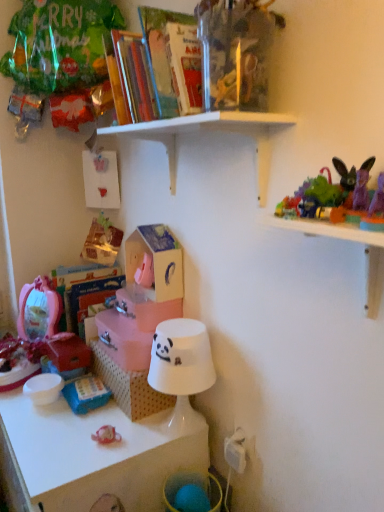
The width and height of the screenshot is (384, 512). What do you see at coordinates (156, 261) in the screenshot? I see `wooden house at center, the first storage box positioned from the top` at bounding box center [156, 261].

In order to face white wooden shelf at upper center, arranged as the first shelf when viewed from the top, should I rotate leftwards or rightwards?

Turn left by 1.722 degrees to look at white wooden shelf at upper center, arranged as the first shelf when viewed from the top.

Find the location of a particular element. The image size is (384, 512). white wooden shelf at upper center, which is the 3th shelf from bottom to top is located at coordinates (206, 131).

What do you see at coordinates (150, 62) in the screenshot? Image resolution: width=384 pixels, height=512 pixels. I see `hardcover book at upper center` at bounding box center [150, 62].

Describe the element at coordinates (133, 326) in the screenshot. I see `pink matte storage box at center, placed as the 2th storage box when sorted from top to bottom` at that location.

At what (x,y) coordinates should I click in order to perform the action: click on wooden house at center, the first storage box positioned from the top. Please return your answer as a coordinate pair (x, y). This screenshot has height=512, width=384. Looking at the image, I should click on (156, 261).

Is blue plastic toy at lower left, the 2th toy from the right, oriented away from white glossy lampshade at lower center, which ranks as the first shelf in bottom-to-top order?

blue plastic toy at lower left, the 2th toy from the right, is not turned away from white glossy lampshade at lower center, which ranks as the first shelf in bottom-to-top order.

Considering the positions of points (67, 386) and (0, 407), is point (67, 386) closer to camera compared to point (0, 407)?

Yes, it is.

Is white glossy lampshade at lower center, which ranks as the first shelf in bottom-to-top order, a part of blue plastic toy at lower left, the second toy viewed from the left?

That's incorrect, white glossy lampshade at lower center, which ranks as the first shelf in bottom-to-top order, is not inside blue plastic toy at lower left, the second toy viewed from the left.

Which is more to the left, blue plastic toy at lower left, which appears as the 1th toy when ordered from the bottom, or white glossy lampshade at lower center, which ranks as the first shelf in bottom-to-top order?

white glossy lampshade at lower center, which ranks as the first shelf in bottom-to-top order.

Based on the photo, does wooden house at center, the first storage box positioned from the top, have a greater width compared to white cardboard box at center?

In fact, wooden house at center, the first storage box positioned from the top, might be narrower than white cardboard box at center.

Could you measure the distance between wooden house at center, which is the second storage box from bottom to top, and white cardboard box at center?

wooden house at center, which is the second storage box from bottom to top, is 11.91 inches away from white cardboard box at center.

Are wooden house at center, which is the second storage box from bottom to top, and white cardboard box at center far apart?

They are positioned close to each other.

Would you say wooden house at center, the first storage box positioned from the top, is inside or outside white cardboard box at center?

wooden house at center, the first storage box positioned from the top, cannot be found inside white cardboard box at center.

Between white glossy lampshade at lower center, which ranks as the first shelf in bottom-to-top order, and pink fabric toy at lower left, the 2th toy from the top, which one has more height?

Standing taller between the two is white glossy lampshade at lower center, which ranks as the first shelf in bottom-to-top order.

I want to click on shelf below the pink fabric toy at lower left, which ranks as the first toy in back-to-front order (from a real-world perspective), so click(94, 455).

Consider the image. From the image's perspective, is white glossy lampshade at lower center, which ranks as the first shelf in bottom-to-top order, under pink fabric toy at lower left, which is the second toy in bottom-to-top order?

Yes.

From a real-world perspective, which is physically below, plush purple rabbit at upper right, arranged as the third toy when viewed from the left, or blue plastic toy at lower left, the 2th toy from the right?

blue plastic toy at lower left, the 2th toy from the right, is physically lower.

In the scene shown: Is plush purple rabbit at upper right, which is counted as the third toy, starting from the bottom, at the right side of blue plastic toy at lower left, the 2th toy from the right?

Yes, plush purple rabbit at upper right, which is counted as the third toy, starting from the bottom, is to the right of blue plastic toy at lower left, the 2th toy from the right.

From the image's perspective, which toy is the 2nd one above the blue plastic toy at lower left, the second toy viewed from the left? Please provide its 2D coordinates.

[(324, 191)]

Is plush purple rabbit at upper right, which is counted as the third toy, starting from the bottom, with blue plastic toy at lower left, which appears as the 1th toy when ordered from the bottom?

No, plush purple rabbit at upper right, which is counted as the third toy, starting from the bottom, is not with blue plastic toy at lower left, which appears as the 1th toy when ordered from the bottom.

Considering the sizes of objects pink matte storage box at center, which ranks as the 1th storage box in bottom-to-top order, and white matte lampshade at center in the image provided, who is bigger, pink matte storage box at center, which ranks as the 1th storage box in bottom-to-top order, or white matte lampshade at center?

white matte lampshade at center.

This screenshot has width=384, height=512. I want to click on storage box that is the 1st one above the white matte lampshade at center (from a real-world perspective), so point(133,326).

Considering the relative sizes of pink matte storage box at center, which ranks as the 1th storage box in bottom-to-top order, and white matte lampshade at center in the image provided, is pink matte storage box at center, which ranks as the 1th storage box in bottom-to-top order, wider than white matte lampshade at center?

Correct, the width of pink matte storage box at center, which ranks as the 1th storage box in bottom-to-top order, exceeds that of white matte lampshade at center.

Is point (70, 403) positioned in front of point (165, 94)?

No, (70, 403) is behind (165, 94).

Identify the location of book that is above the blue plastic toy at lower left, the second toy viewed from the left (from a real-world perspective). Image resolution: width=384 pixels, height=512 pixels. (150, 62).

Are blue plastic toy at lower left, which is the second toy in front-to-back order, and hardcover book at upper center located far from each other?

blue plastic toy at lower left, which is the second toy in front-to-back order, is actually quite close to hardcover book at upper center.

Which of these two, blue plastic toy at lower left, the second toy viewed from the back, or hardcover book at upper center, is thinner?

Thinner between the two is blue plastic toy at lower left, the second toy viewed from the back.

In the image, there is a transparent plastic toys at upper right, arranged as the second shelf when viewed from the top. At what (x,y) coordinates should I click in order to perform the action: click on storage box above it (from the image's perspective). Please return your answer as a coordinate pair (x, y). This screenshot has width=384, height=512. Looking at the image, I should click on (156, 261).

From a real-world perspective, between wooden house at center, which is the second storage box from bottom to top, and transparent plastic toys at upper right, arranged as the second shelf when viewed from the top, who is vertically lower?

In real-world perspective, wooden house at center, which is the second storage box from bottom to top, is lower.

From the image's perspective, relative to transparent plastic toys at upper right, arranged as the second shelf when viewed from the top, is wooden house at center, the first storage box positioned from the top, above or below?

wooden house at center, the first storage box positioned from the top, is situated higher than transparent plastic toys at upper right, arranged as the second shelf when viewed from the top, in the image.

Is wooden house at center, the first storage box positioned from the top, not close to transparent plastic toys at upper right, arranged as the second shelf when viewed from the top?

wooden house at center, the first storage box positioned from the top, is near transparent plastic toys at upper right, arranged as the second shelf when viewed from the top, not far away.

From the white glossy lampshade at lower center, which ranks as the first shelf in bottom-to-top order, count 1st toys backward and point to it. Please provide its 2D coordinates.

[(86, 393)]

You are a GUI agent. You are given a task and a screenshot of the screen. Output one action in this format:
    pyautogui.click(x=<x>, y=<y>)
    Task: Click on the 2nd storage box to the right of the white cardboard box at center, counting from the anchor's position
    
    Given the screenshot: What is the action you would take?
    pyautogui.click(x=156, y=261)

Which object lies nearer to the anchor point transparent plastic toys at upper right, which is the 2th shelf in bottom-to-top order, white wooden shelf at upper center, arranged as the first shelf when viewed from the top, or blue plastic toy at lower left, which appears as the 1th toy when ordered from the bottom?

white wooden shelf at upper center, arranged as the first shelf when viewed from the top, lies closer to transparent plastic toys at upper right, which is the 2th shelf in bottom-to-top order, than the other object.

Considering their positions, is white glossy lampshade at lower center, which ranks as the first shelf in bottom-to-top order, positioned closer to white cardboard box at center than pink matte storage box at center, placed as the 2th storage box when sorted from top to bottom?

The object closer to white cardboard box at center is pink matte storage box at center, placed as the 2th storage box when sorted from top to bottom.

Considering their positions, is white wooden shelf at upper center, which is the 3th shelf from bottom to top, positioned closer to blue plastic toy at lower left, which is the second toy in front-to-back order, than wooden house at center, which is the second storage box from bottom to top?

wooden house at center, which is the second storage box from bottom to top, is positioned closer to the anchor blue plastic toy at lower left, which is the second toy in front-to-back order.

Consider the image. Considering their positions, is wooden house at center, which is the second storage box from bottom to top, positioned further to hardcover book at upper center than plush purple rabbit at upper right, the first toy from the top?

plush purple rabbit at upper right, the first toy from the top, is positioned further to the anchor hardcover book at upper center.

Considering their positions, is transparent plastic toys at upper right, arranged as the second shelf when viewed from the top, positioned closer to plush purple rabbit at upper right, arranged as the third toy when viewed from the left, than pink fabric toy at lower left, acting as the first toy starting from the left?

transparent plastic toys at upper right, arranged as the second shelf when viewed from the top, is positioned closer to the anchor plush purple rabbit at upper right, arranged as the third toy when viewed from the left.

Which object lies further to the anchor point white glossy lampshade at lower center, acting as the 3th shelf starting from the top, transparent plastic toys at upper right, which is the 2th shelf in bottom-to-top order, or blue plastic toy at lower left, which appears as the 1th toy when ordered from the bottom?

Based on the image, transparent plastic toys at upper right, which is the 2th shelf in bottom-to-top order, appears to be further to white glossy lampshade at lower center, acting as the 3th shelf starting from the top.

When comparing their distances from wooden house at center, the first storage box positioned from the top, does plush purple rabbit at upper right, which is counted as the third toy, starting from the bottom, or transparent plastic toys at upper right, arranged as the second shelf when viewed from the top, seem further?

plush purple rabbit at upper right, which is counted as the third toy, starting from the bottom, lies further to wooden house at center, the first storage box positioned from the top, than the other object.

Looking at the image, which one is located further to blue plastic toy at lower left, which appears as the 1th toy when ordered from the bottom, white matte lampshade at center or transparent plastic toys at upper right, arranged as the second shelf when viewed from the top?

Based on the image, transparent plastic toys at upper right, arranged as the second shelf when viewed from the top, appears to be further to blue plastic toy at lower left, which appears as the 1th toy when ordered from the bottom.

Identify the location of toy situated between pink fabric toy at lower left, acting as the third toy starting from the front, and white cardboard box at center from left to right. This screenshot has height=512, width=384. (86, 393).

Locate an element on the screen. The width and height of the screenshot is (384, 512). cardboard box between white wooden shelf at upper center, which is the 3th shelf from bottom to top, and white glossy lampshade at lower center, acting as the 3th shelf starting from the top, in the vertical direction is located at coordinates (128, 386).

Locate an element on the screen. toy between pink fabric toy at lower left, the 2th toy from the top, and pink matte storage box at center, placed as the 2th storage box when sorted from top to bottom is located at coordinates (86, 393).

Where is `shelf between white wooden shelf at upper center, arranged as the first shelf when viewed from the top, and white glossy lampshade at lower center, acting as the 3th shelf starting from the top, in the up-down direction`? This screenshot has height=512, width=384. shelf between white wooden shelf at upper center, arranged as the first shelf when viewed from the top, and white glossy lampshade at lower center, acting as the 3th shelf starting from the top, in the up-down direction is located at coordinates (345, 240).